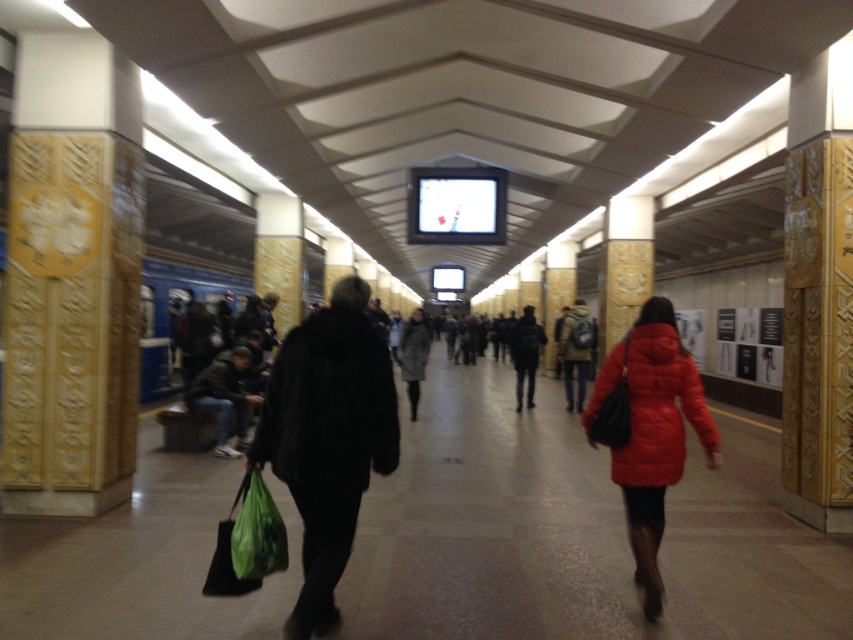
Between black fur coat at center and matte black backpack at center, which one has less height?

matte black backpack at center

Is the position of black fur coat at center more distant than that of matte black backpack at center?

No, it is not.

Does point (292, 467) lie in front of point (585, 320)?

Yes, point (292, 467) is closer to viewer.

Where is `black fur coat at center`? Image resolution: width=853 pixels, height=640 pixels. black fur coat at center is located at coordinates (329, 406).

Does black fur coat at center appear over dark gray jacket at center?

Yes.

Which is in front, point (292, 358) or point (532, 317)?

Positioned in front is point (292, 358).

Does point (322, 456) come in front of point (515, 388)?

Yes.

At what (x,y) coordinates should I click in order to perform the action: click on black fur coat at center. Please return your answer as a coordinate pair (x, y). The image size is (853, 640). Looking at the image, I should click on (329, 406).

Is matte red jacket at right below matte black backpack at center?

No.

Is matte red jacket at right positioned at the back of matte black backpack at center?

No, it is in front of matte black backpack at center.

Image resolution: width=853 pixels, height=640 pixels. What do you see at coordinates (654, 406) in the screenshot?
I see `matte red jacket at right` at bounding box center [654, 406].

You are a GUI agent. You are given a task and a screenshot of the screen. Output one action in this format:
    pyautogui.click(x=<x>, y=<y>)
    Task: Click on the matte red jacket at right
    The image size is (853, 640).
    Given the screenshot: What is the action you would take?
    pyautogui.click(x=654, y=406)